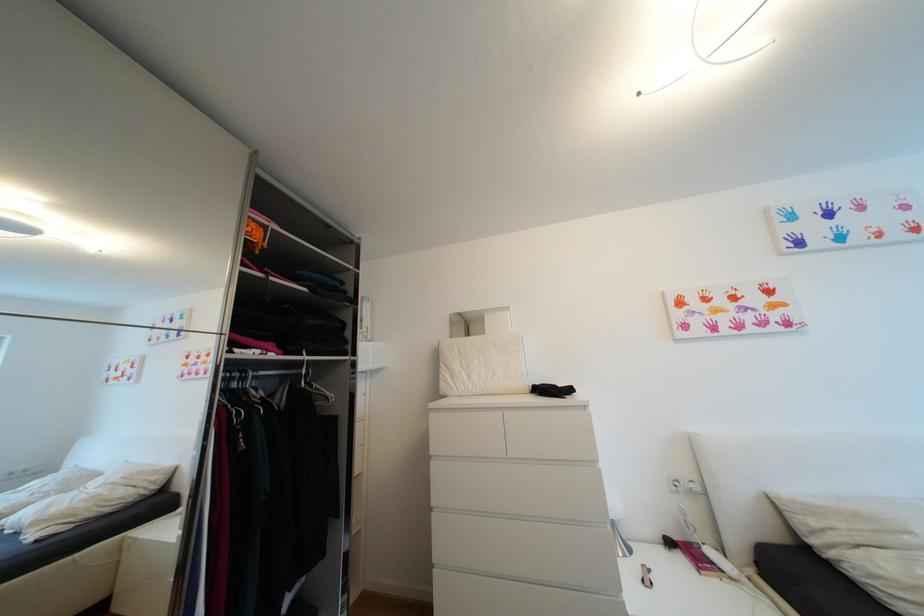
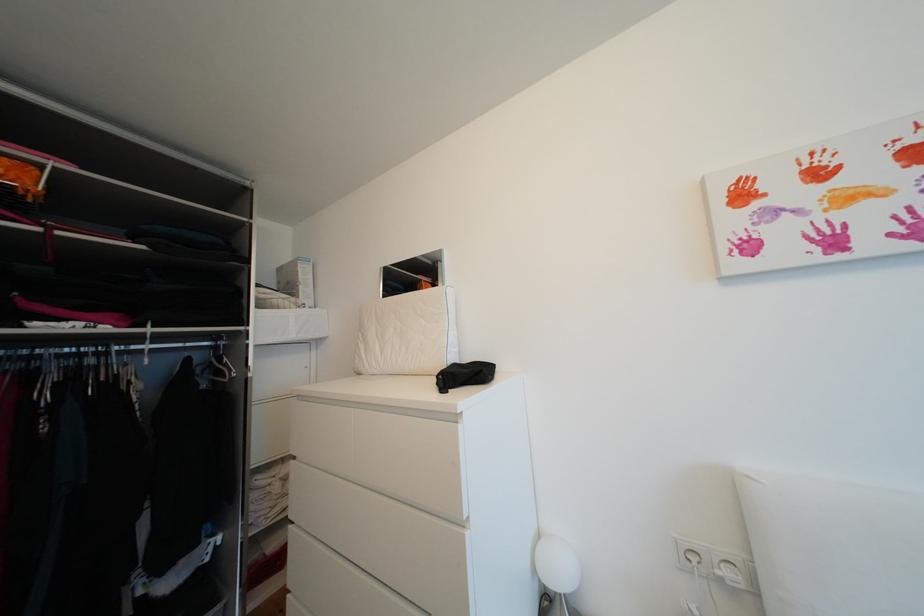
Find the pixel in the second image that matches pixel 544 384 in the first image.

(473, 362)